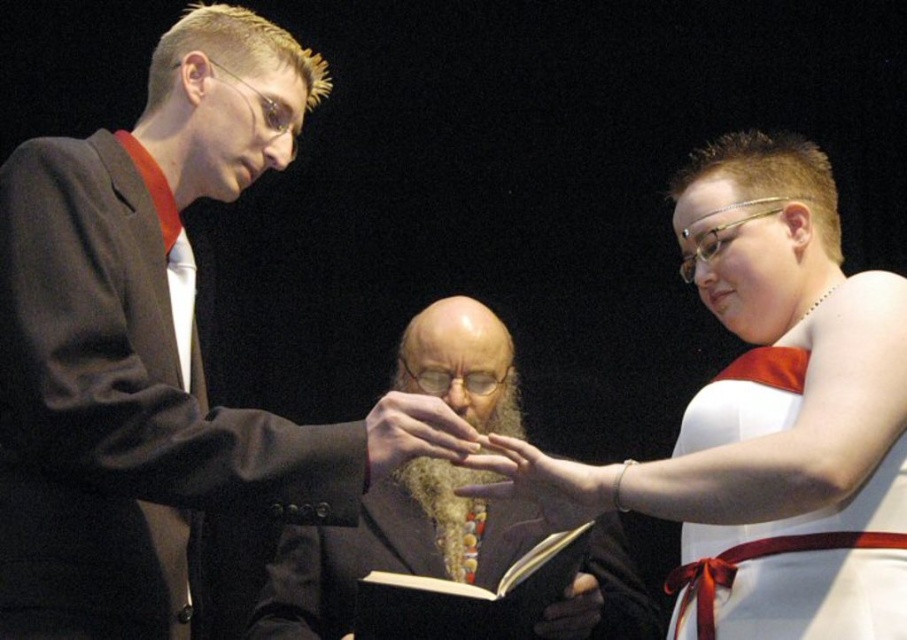
Can you confirm if bearded man at center is positioned to the right of brown leather glove at center?

In fact, bearded man at center is to the left of brown leather glove at center.

Is bearded man at center positioned at the back of brown leather glove at center?

No.

In order to click on bearded man at center in this screenshot , I will do `click(389, 548)`.

You are a GUI agent. You are given a task and a screenshot of the screen. Output one action in this format:
    pyautogui.click(x=<x>, y=<y>)
    Task: Click on the bearded man at center
    The image size is (907, 640).
    Given the screenshot: What is the action you would take?
    pyautogui.click(x=389, y=548)

Which is behind, point (424, 554) or point (539, 477)?

Point (424, 554)

Between point (333, 592) and point (467, 461), which one is positioned in front?

Point (467, 461) is in front.

At what (x,y) coordinates should I click in order to perform the action: click on bearded man at center. Please return your answer as a coordinate pair (x, y). Looking at the image, I should click on (389, 548).

Is smooth skin hand at center shorter than matte gold ring at center?

No.

Which is behind, point (478, 490) or point (466, 438)?

The point (478, 490) is more distant.

This screenshot has width=907, height=640. Find the location of `smooth skin hand at center`. smooth skin hand at center is located at coordinates (542, 483).